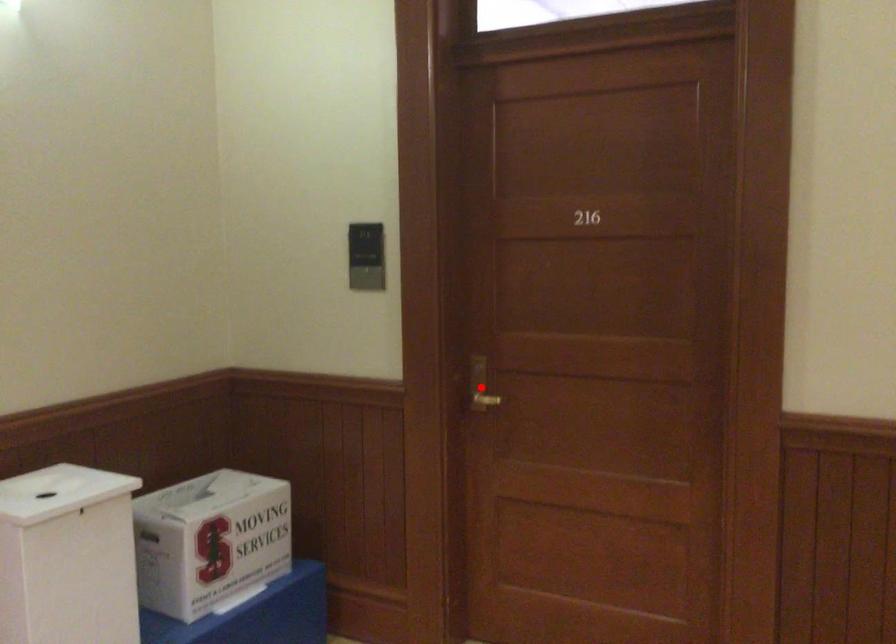
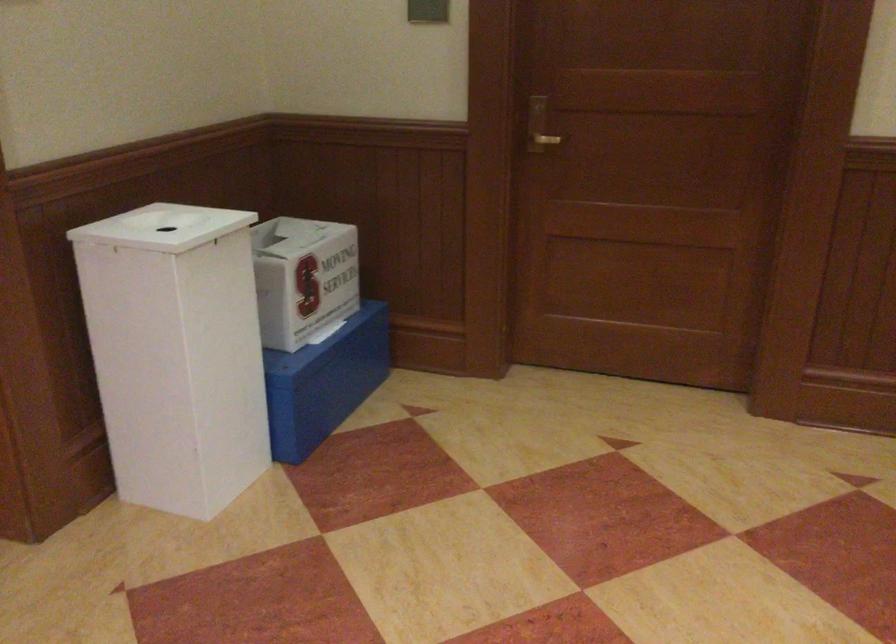
Locate, in the second image, the point that corresponds to the highlighted location in the first image.

(538, 126)